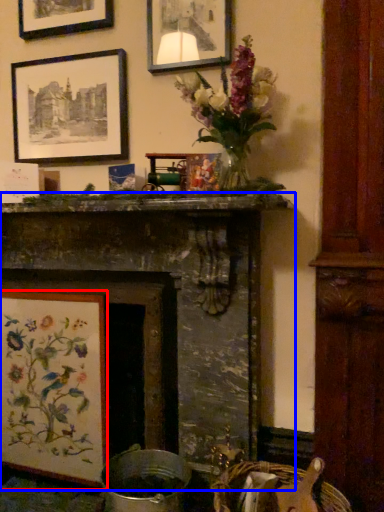
Question: Which of the following is the farthest to the observer, picture frame (highlighted by a red box) or fireplace (highlighted by a blue box)?

Choices:
 (A) picture frame
 (B) fireplace

Answer: (A)